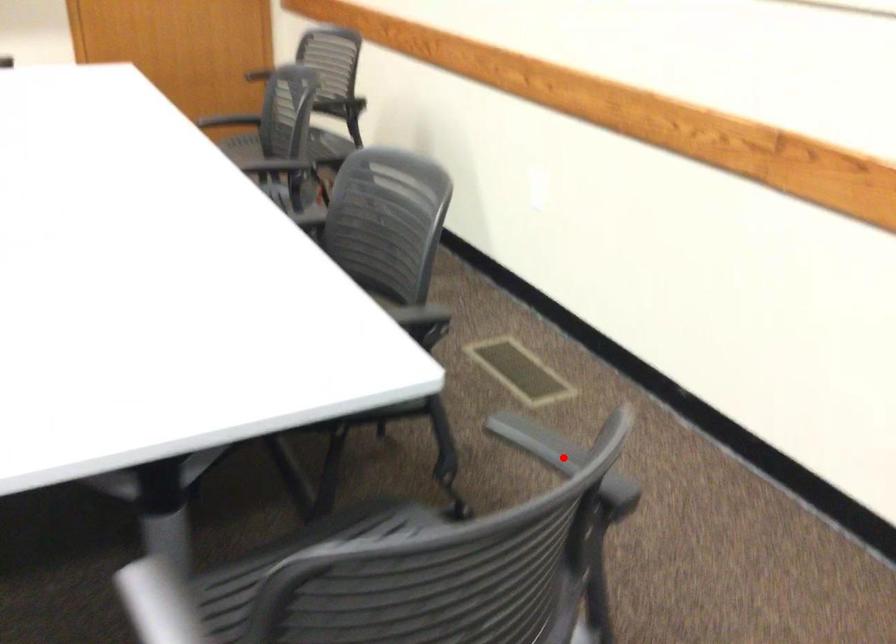
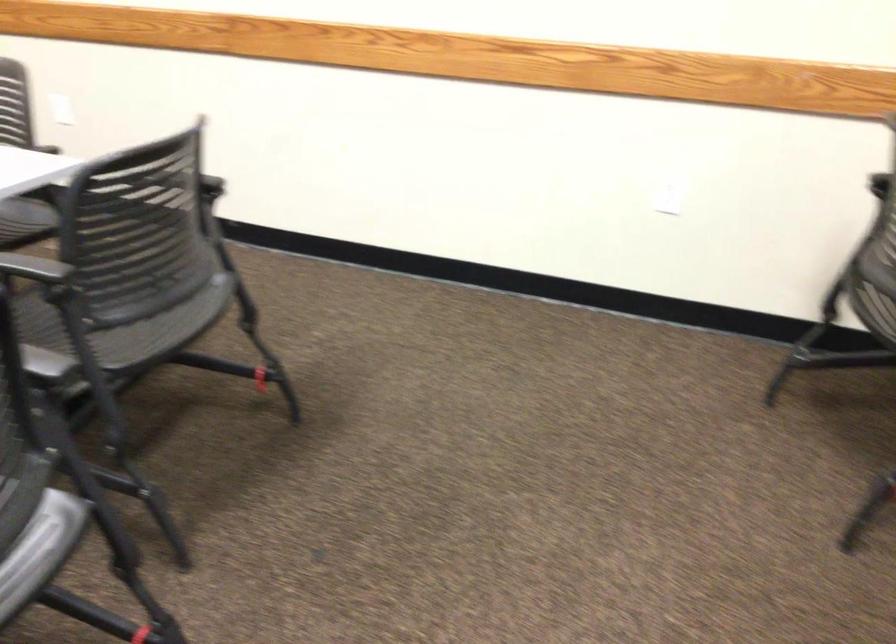
Question: I am providing you with two images of the same scene from different viewpoints. A red point is marked on the first image. Is the red point's position out of view in image 2?

Choices:
 (A) Yes
 (B) No

Answer: (A)